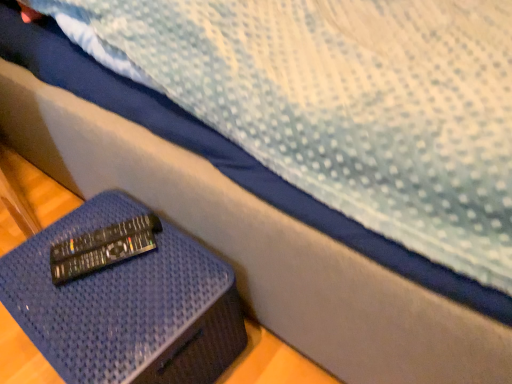
Find the location of `vacant area that lies to the right of black plastic remote at lower left, acting as the 2th remote starting from the front`. vacant area that lies to the right of black plastic remote at lower left, acting as the 2th remote starting from the front is located at coordinates (179, 258).